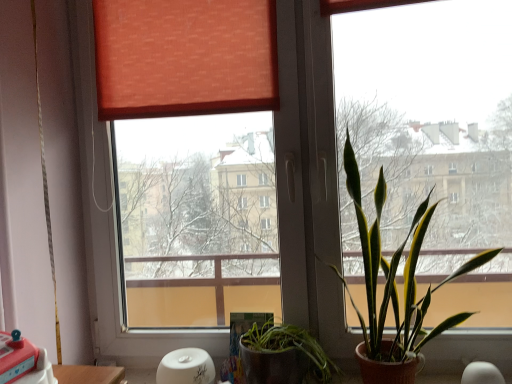
This screenshot has height=384, width=512. Describe the element at coordinates (395, 287) in the screenshot. I see `green leafy plant at right` at that location.

You are a GUI agent. You are given a task and a screenshot of the screen. Output one action in this format:
    pyautogui.click(x=<x>, y=<y>)
    Task: Click on the green leafy plant at right
    This screenshot has height=384, width=512.
    Given the screenshot: What is the action you would take?
    pyautogui.click(x=395, y=287)

At what (x,y) coordinates should I click in order to perform the action: click on wooden table at lower left. Please return your answer as a coordinate pair (x, y). Looking at the image, I should click on (88, 374).

Describe the element at coordinates (88, 374) in the screenshot. The image size is (512, 384). I see `wooden table at lower left` at that location.

This screenshot has height=384, width=512. I want to click on green leafy plant at right, so click(x=395, y=287).

Which object is positioned more to the left, green leafy plant at right or wooden table at lower left?

wooden table at lower left.

Considering their positions, is green leafy plant at right located in front of or behind wooden table at lower left?

green leafy plant at right is positioned closer to the viewer than wooden table at lower left.

Is point (372, 303) positioned behind point (96, 381)?

That is True.

From the image's perspective, is green leafy plant at right located beneath wooden table at lower left?

No, from the image's perspective, green leafy plant at right is not beneath wooden table at lower left.

From a real-world perspective, which object rests below the other?

wooden table at lower left, from a real-world perspective.

Is green leafy plant at right thinner than wooden table at lower left?

In fact, green leafy plant at right might be wider than wooden table at lower left.

Does green leafy plant at right have a lesser height compared to wooden table at lower left?

No, green leafy plant at right is not shorter than wooden table at lower left.

Does green leafy plant at right have a larger size compared to wooden table at lower left?

Indeed, green leafy plant at right has a larger size compared to wooden table at lower left.

Is green leafy plant at right not inside wooden table at lower left?

green leafy plant at right lies outside wooden table at lower left's area.

Is green leafy plant at right far away from wooden table at lower left?

That's not correct — green leafy plant at right is a little close to wooden table at lower left.

Is green leafy plant at right positioned with its back to wooden table at lower left?

That's not correct — green leafy plant at right is not looking away from wooden table at lower left.

What's the angular difference between green leafy plant at right and wooden table at lower left's facing directions?

The facing directions of green leafy plant at right and wooden table at lower left are 90 degrees apart.

You are a GUI agent. You are given a task and a screenshot of the screen. Output one action in this format:
    pyautogui.click(x=<x>, y=<y>)
    Task: Click on the table located on the left of green leafy plant at right
    
    Given the screenshot: What is the action you would take?
    pyautogui.click(x=88, y=374)

Visually, is wooden table at lower left positioned to the left or to the right of green leafy plant at right?

In the image, wooden table at lower left appears on the left side of green leafy plant at right.

Who is more distant, wooden table at lower left or green leafy plant at right?

Positioned behind is wooden table at lower left.

Is point (119, 382) farther from camera compared to point (396, 345)?

No.

From the image's perspective, is wooden table at lower left positioned above or below green leafy plant at right?

wooden table at lower left is situated lower than green leafy plant at right in the image.

From a real-world perspective, which is physically below, wooden table at lower left or green leafy plant at right?

wooden table at lower left.

Which object is thinner, wooden table at lower left or green leafy plant at right?

Thinner between the two is wooden table at lower left.

Which of these two, wooden table at lower left or green leafy plant at right, stands taller?

Result: green leafy plant at right.

Which of these two, wooden table at lower left or green leafy plant at right, is smaller?

wooden table at lower left.

Is wooden table at lower left situated inside green leafy plant at right or outside?

wooden table at lower left lies outside green leafy plant at right.

Is there a large distance between wooden table at lower left and green leafy plant at right?

wooden table at lower left is actually quite close to green leafy plant at right.

Could you tell me if wooden table at lower left is facing green leafy plant at right?

Yes, wooden table at lower left faces towards green leafy plant at right.

What's the angular difference between wooden table at lower left and green leafy plant at right's facing directions?

The facing directions of wooden table at lower left and green leafy plant at right are 90 degrees apart.

Image resolution: width=512 pixels, height=384 pixels. I want to click on table beneath the green leafy plant at right (from a real-world perspective), so click(x=88, y=374).

Locate an element on the screen. The height and width of the screenshot is (384, 512). houseplant on the right of wooden table at lower left is located at coordinates (395, 287).

Find the location of `houseplant above the wooden table at lower left (from the image's perspective)`. houseplant above the wooden table at lower left (from the image's perspective) is located at coordinates (395, 287).